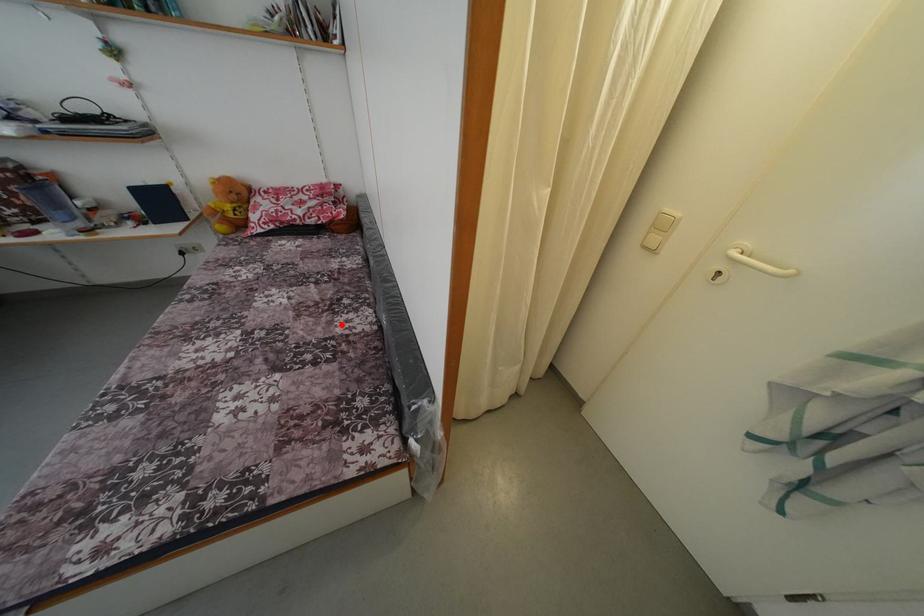
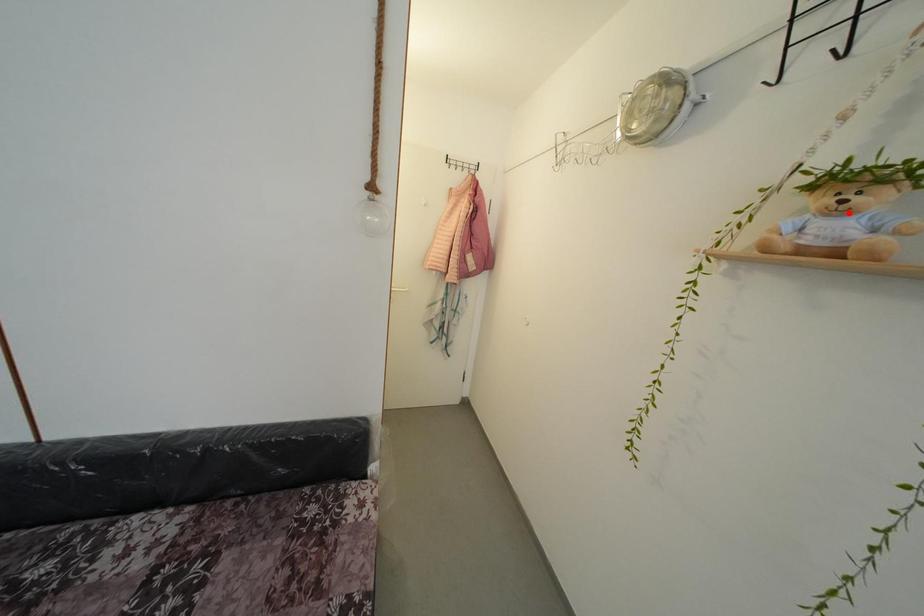
I am providing you with two images of the same scene from different viewpoints. A red point is marked on the first image and another point is marked on the second image. Does the point marked in image1 correspond to the same location as the one in image2?

No